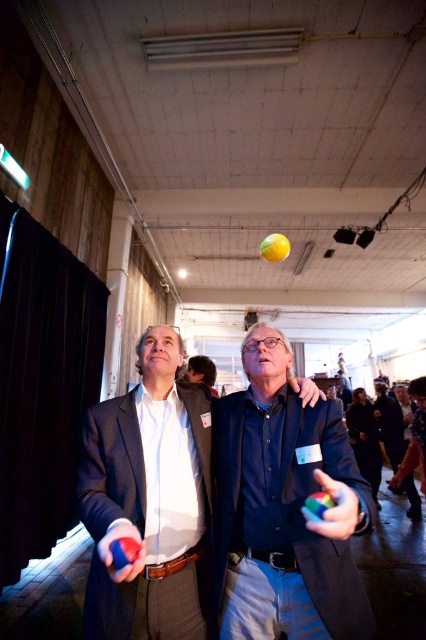
Does matte black jacket at center come behind smooth brown leather jacket at center?

No, it is in front of smooth brown leather jacket at center.

Does matte black jacket at center appear on the right side of smooth brown leather jacket at center?

Yes, matte black jacket at center is to the right of smooth brown leather jacket at center.

What are the coordinates of `matte black jacket at center` in the screenshot? It's located at (284, 508).

Identify the location of matte black jacket at center. This screenshot has height=640, width=426. (284, 508).

Does matte black suit at left appear on the right side of smooth brown leather jacket at center?

Incorrect, matte black suit at left is not on the right side of smooth brown leather jacket at center.

Is point (103, 620) positioned in front of point (187, 378)?

Yes, it is.

Is point (92, 468) positioned before point (201, 362)?

Yes.

Locate an element on the screen. matte black suit at left is located at coordinates (111, 467).

Is white shirt at center wider than matte black suit at left?

No.

Does white shirt at center have a larger size compared to matte black suit at left?

Yes, white shirt at center is bigger than matte black suit at left.

Locate an element on the screen. The image size is (426, 640). white shirt at center is located at coordinates (146, 499).